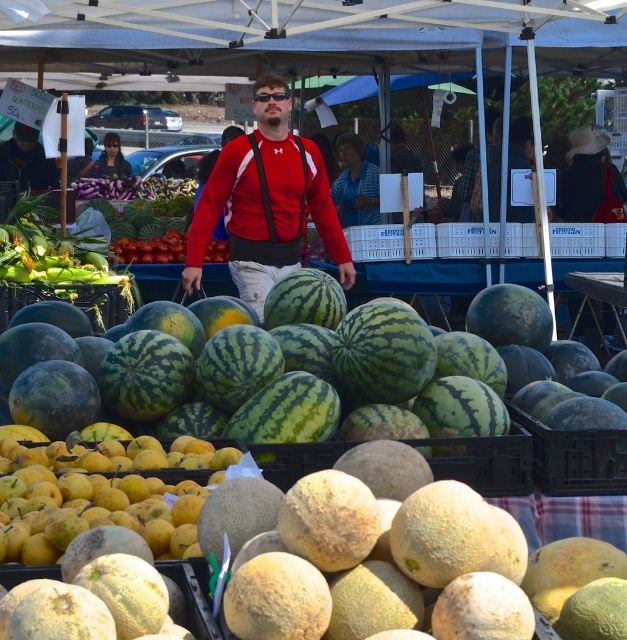
Where is the green striped watermelon at center located in the image?

The green striped watermelon at center is located at point (271, 378).

You are a customer at the farmer market and want to buy the green striped watermelon at center and the matte red jacket at center. However, you can only reach items that are in front of you. Since you are standing at the front of the market, which item can you access first?

The green striped watermelon at center is in front of the matte red jacket at center, so you can access the green striped watermelon at center first since it is closer to you.

You are a customer at the market and want to know if the green striped watermelon at center can fit through a doorway that is the same width as the matte red jacket at center. Can it fit?

The green striped watermelon at center is wider than the matte red jacket at center, so it cannot fit through the doorway that is the same width as the matte red jacket at center.